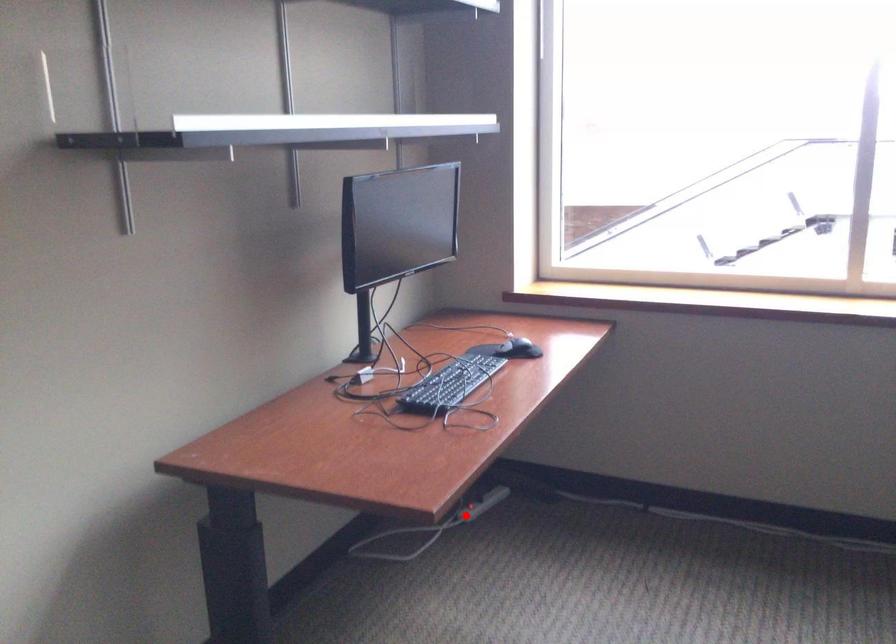
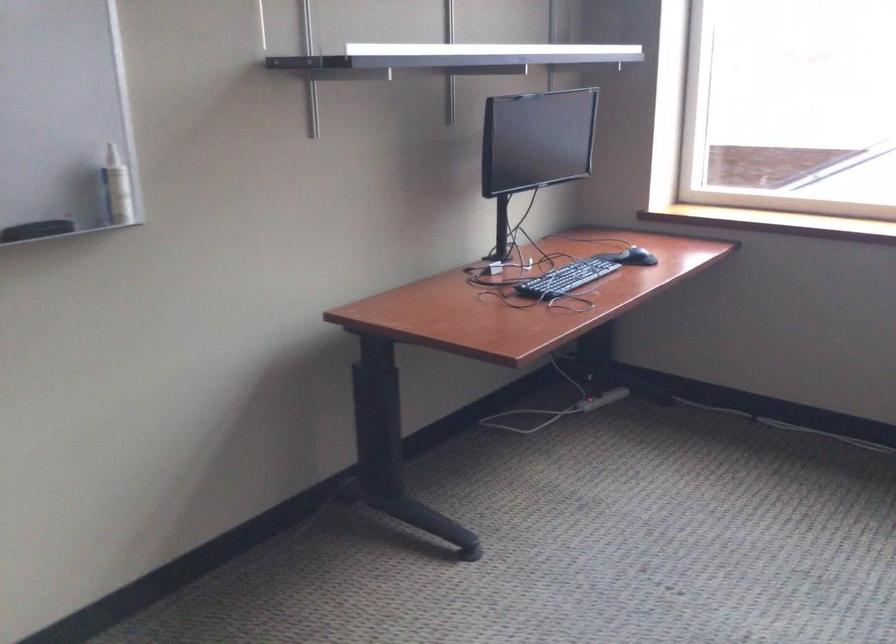
Find the pixel in the second image that matches the highlighted location in the first image.

(587, 404)